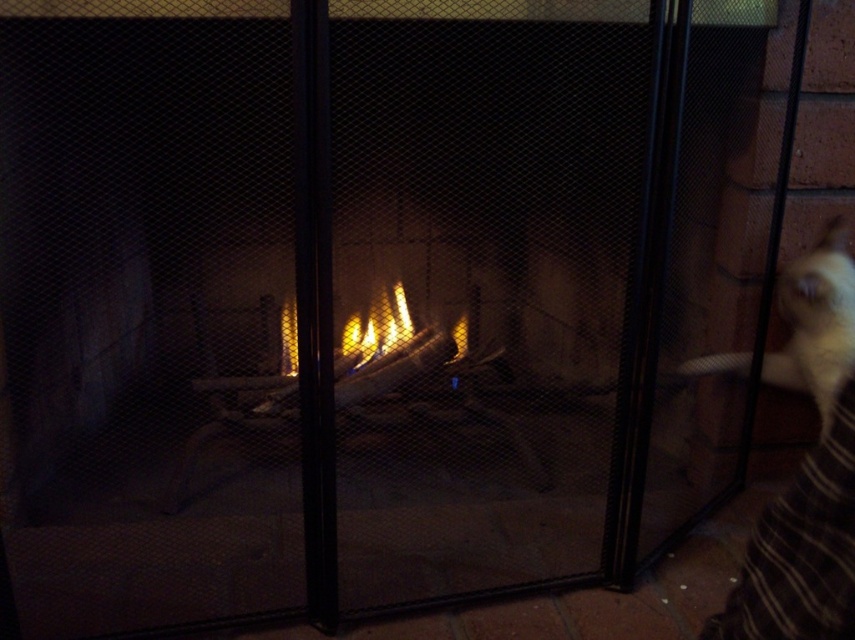
You are a guest in this room and want to take a photo of the white fur cat at right and the flametransparentfire at center without any obstructions. Is there a clear line of sight between you and both objects?

→ The white fur cat at right is in front of the flametransparentfire at center, so taking a photo of both without obstructions would require positioning yourself so that the cat doesn not block the view of the fire. Since the cat is in front of the fire, you can take the photo by angling your camera around the cat to capture both the cat and the fire behind it.

You are a guest at this cozy fireplace scene. You want to place a small decorative item between the white fur cat at right and the flametransparentfire at center. Based on their sizes, which object should the item be closer to?

The white fur cat at right is larger in size than the flametransparentfire at center, so the item should be placed closer to the flametransparentfire at center to maintain balance between the two objects.

You are a guest in this living room and want to pet the white fur cat at right. To reach it, you need to walk around the flametransparentfire at center. Is the cat above or below the fire?

The white fur cat at right is located above the flametransparentfire at center, so the cat is above the fire.